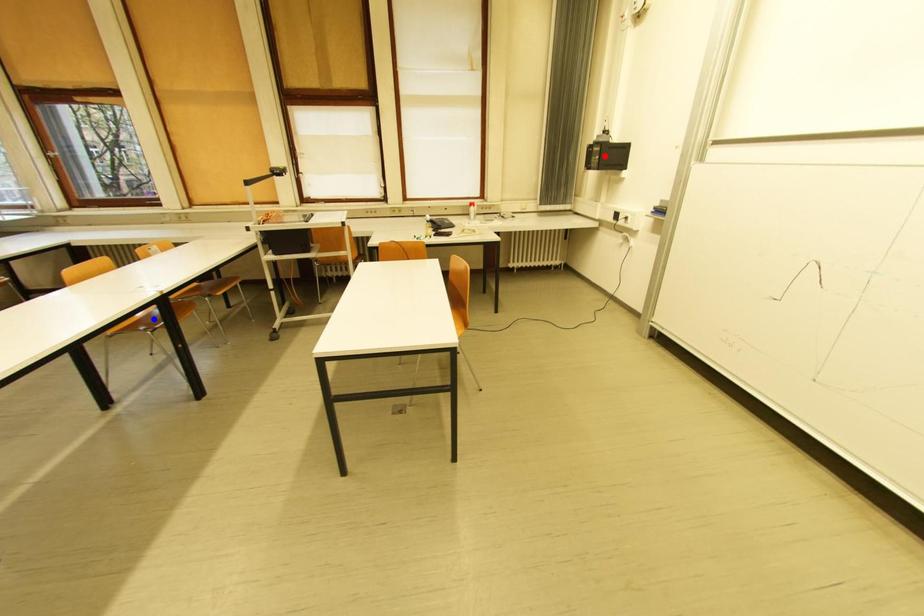
Question: Two points are marked on the image. Which point is closer to the camera?

Choices:
 (A) Blue point is closer.
 (B) Red point is closer.

Answer: (A)